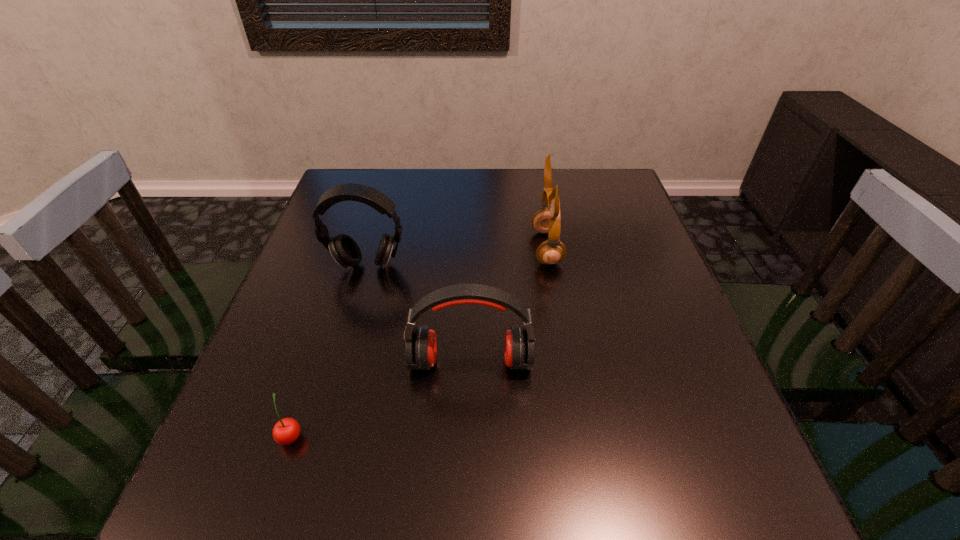
In the image, there is a desktop. In order to click on free space at the near right corner in this screenshot , I will do `click(773, 528)`.

Image resolution: width=960 pixels, height=540 pixels. I want to click on free space between the cherry and the nearest earphone, so click(x=381, y=399).

Identify the location of empty space that is in between the cherry and the third farthest object. The width and height of the screenshot is (960, 540). (381, 399).

Where is `free space that is in between the leftmost earphone and the shortest object`? The height and width of the screenshot is (540, 960). free space that is in between the leftmost earphone and the shortest object is located at coordinates (329, 350).

Find the location of `unoccupied area between the leftmost earphone and the shortest object`. unoccupied area between the leftmost earphone and the shortest object is located at coordinates (329, 350).

Locate an element on the screen. free area in between the leftmost earphone and the rightmost object is located at coordinates click(x=457, y=256).

The image size is (960, 540). Identify the location of unoccupied area between the nearest object and the leftmost earphone. (329, 350).

This screenshot has width=960, height=540. Identify the location of blank region between the leftmost earphone and the shortest object. (329, 350).

Identify which object is located as the nearest to the cherry. Please provide its 2D coordinates. Your answer should be formatted as a tuple, i.e. [(x, y)], where the tuple contains the x and y coordinates of a point satisfying the conditions above.

[(421, 344)]

Identify which object is the nearest to the leftmost earphone. Please provide its 2D coordinates. Your answer should be formatted as a tuple, i.e. [(x, y)], where the tuple contains the x and y coordinates of a point satisfying the conditions above.

[(421, 344)]